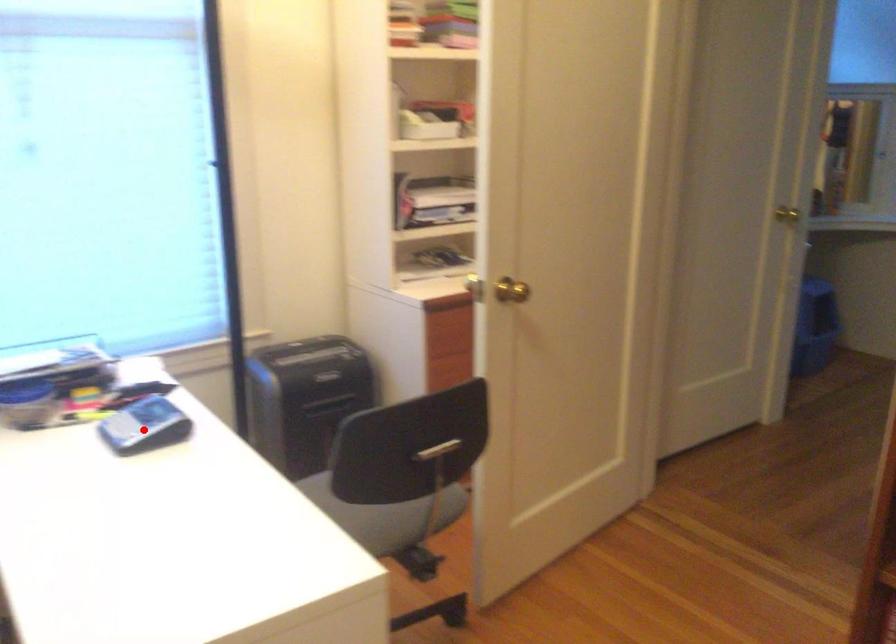
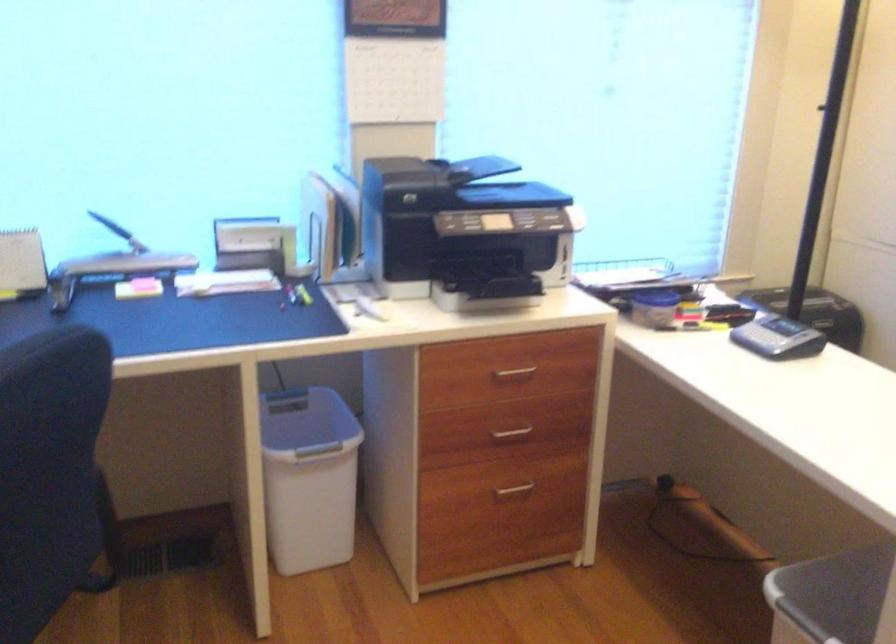
Question: I am providing you with two images of the same scene from different viewpoints. Image1 has a red point marked. In image2, the corresponding 3D location appears at what relative position? Reply with the corresponding letter.

Choices:
 (A) Closer
 (B) Farther

Answer: (B)